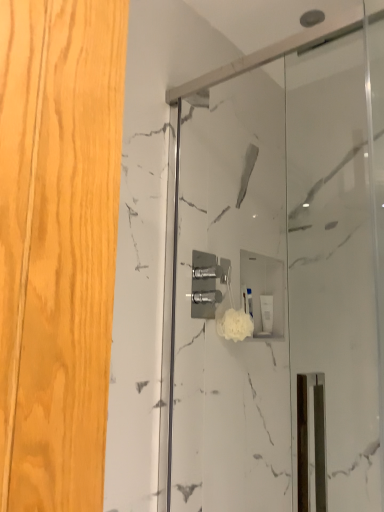
Question: Is white matte soap dispenser at center taller or shorter than white fluffy sponge at center?

Choices:
 (A) short
 (B) tall

Answer: (B)

Question: From the image's perspective, is white matte soap dispenser at center located above or below white fluffy sponge at center?

Choices:
 (A) below
 (B) above

Answer: (A)

Question: Estimate the real-world distances between objects in this image. Which object is farther from the white matte soap dispenser at center?

Choices:
 (A) white fluffy sponge at center
 (B) white marble shower door at center

Answer: (B)

Question: Which object is the closest to the white marble shower door at center?

Choices:
 (A) white fluffy sponge at center
 (B) white matte soap dispenser at center

Answer: (A)